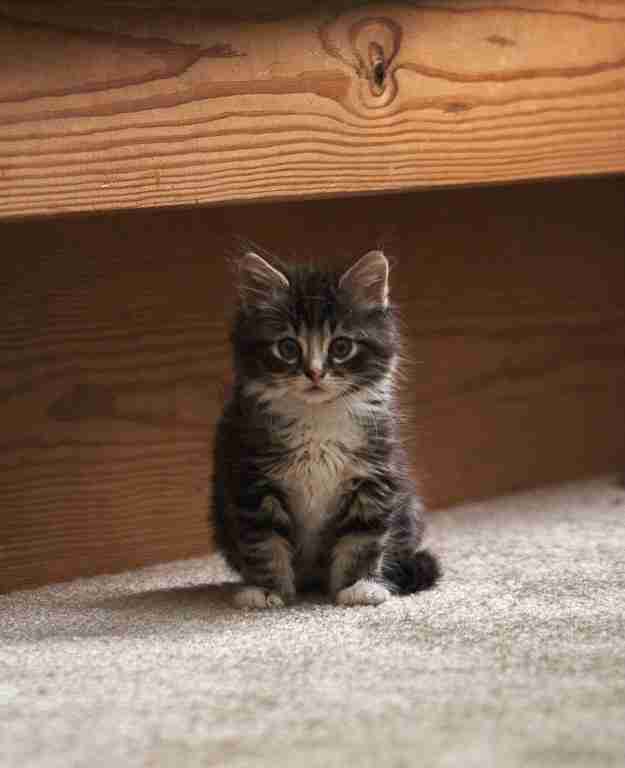
Image resolution: width=625 pixels, height=768 pixels. What are the coordinates of `wood top` in the screenshot? It's located at (562, 78).